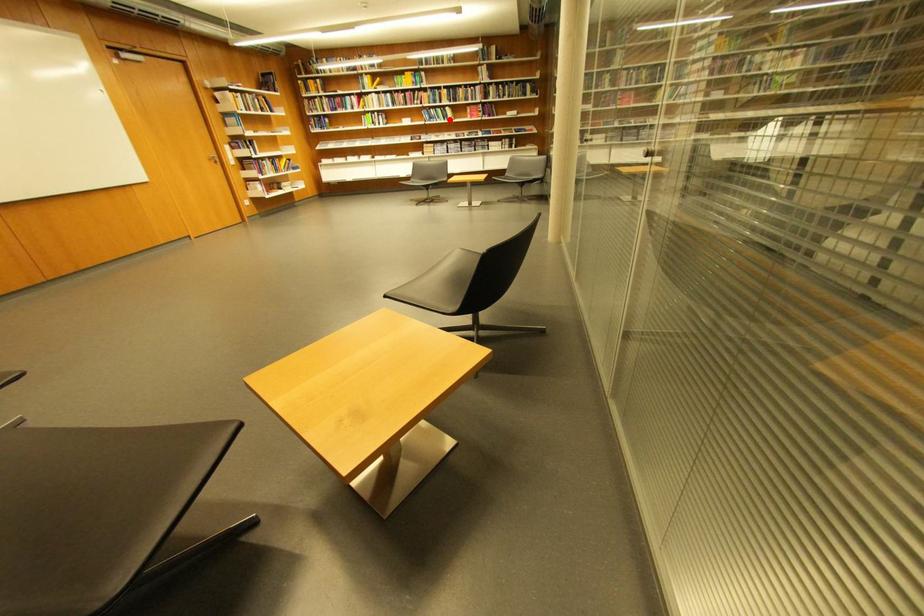
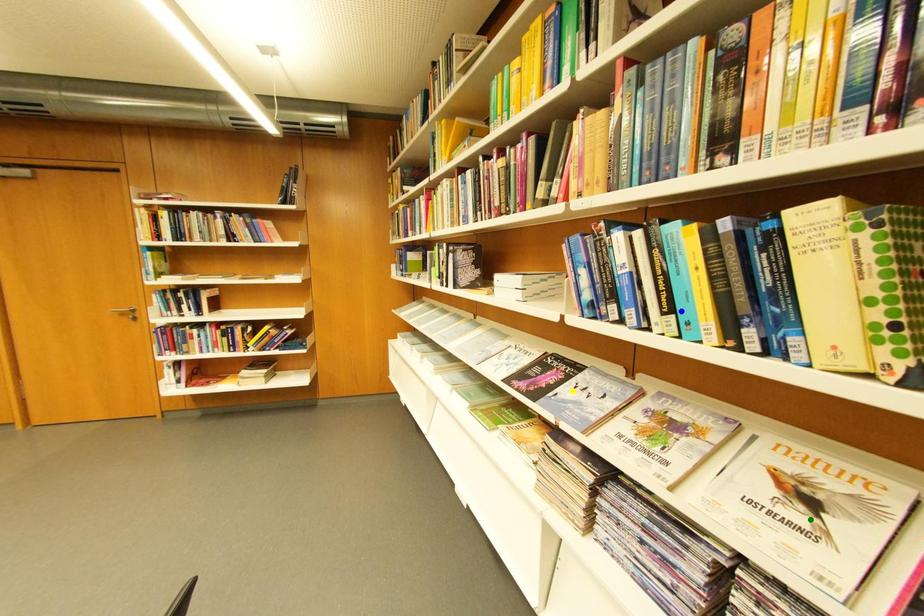
Question: I am providing you with two images of the same scene from different viewpoints. A red point is marked on the first image. You are given multiple points on the second image. Which point in image 2 represents the same 3d spot as the red point in image 1?

Choices:
 (A) green point
 (B) blue point
 (C) yellow point

Answer: (B)